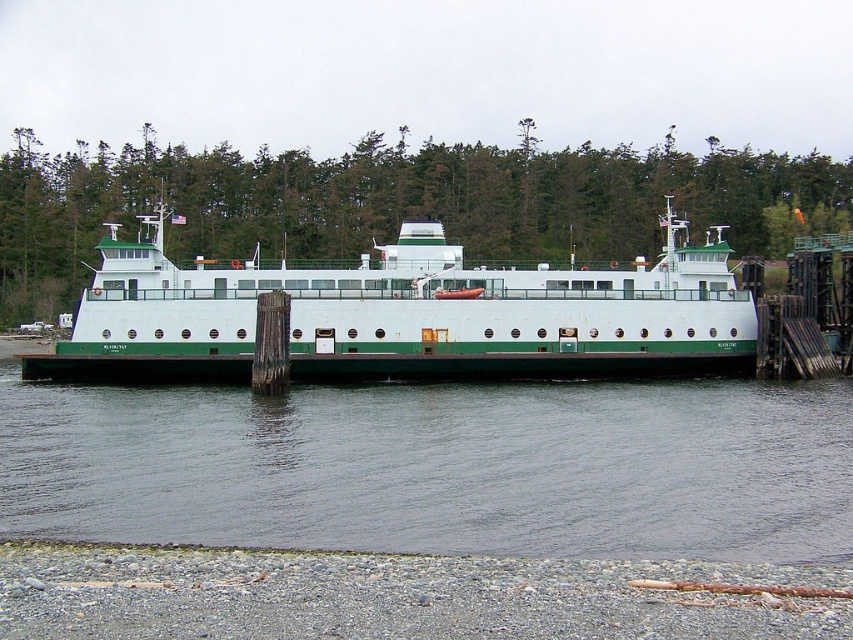
You are standing on the gray gravel shoreline at lower left and want to board the white matte ferry at center. Based on their sizes, can you estimate whether the ferry will have enough space to accommodate you and your luggage?

The white matte ferry at center has a larger width than the gray gravel shoreline at lower left, so it should have sufficient space to accommodate you and your luggage.

You are a passenger on the ferry and want to know if you can move from the white matte ferry at center to the green water at center without getting wet. Can you do that?

The green water at center has a lesser width compared to the white matte ferry at center, so the distance between them is narrow. However, attempting to move between them may still result in getting wet as the water is present between the ferry and the pier.